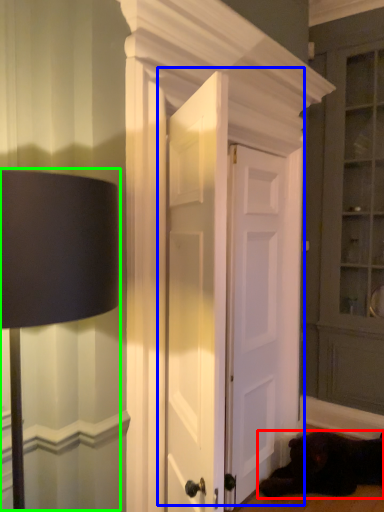
Question: Which object is the farthest from dog (highlighted by a red box)? Choose among these: door (highlighted by a blue box) or table lamp (highlighted by a green box).

Choices:
 (A) door
 (B) table lamp

Answer: (B)